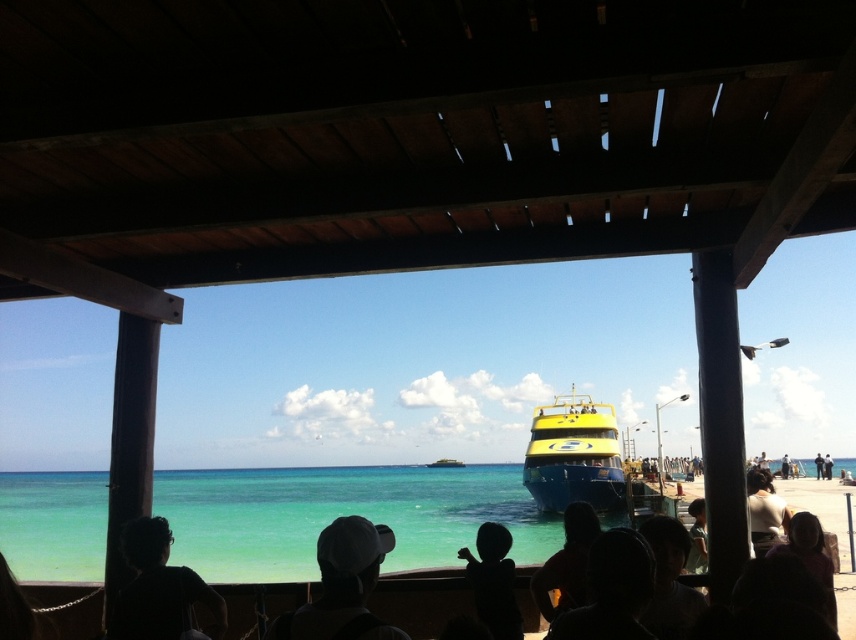
Question: Can you confirm if yellow matte boat at center is positioned above black matte head at lower left?

Choices:
 (A) yes
 (B) no

Answer: (B)

Question: Which object is farther from the camera taking this photo?

Choices:
 (A) yellow matte boat at center
 (B) black fabric headscarf at lower center
 (C) dark purple shirt at lower right
 (D) black matte head at lower left

Answer: (A)

Question: Which point is farther to the camera?

Choices:
 (A) black fabric headscarf at lower center
 (B) black matte head at lower left

Answer: (B)

Question: Does clear blue water at lower center have a greater width compared to dark purple shirt at lower right?

Choices:
 (A) no
 (B) yes

Answer: (B)

Question: Is clear blue water at lower center wider than black matte head at lower left?

Choices:
 (A) no
 (B) yes

Answer: (B)

Question: Considering the real-world distances, which object is farthest from the white fabric cap at center?

Choices:
 (A) black matte head at lower left
 (B) light brown hair at center
 (C) clear blue water at lower center

Answer: (C)